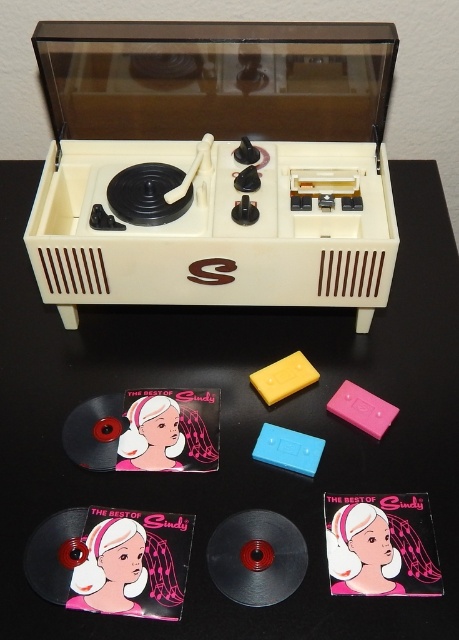
Question: Is beige plastic record player at center bigger than matte pink vinyl record at lower left?

Choices:
 (A) no
 (B) yes

Answer: (B)

Question: Is matte pink vinyl record at lower center to the left of black plastic record at center from the viewer's perspective?

Choices:
 (A) yes
 (B) no

Answer: (B)

Question: Which is farther from the matte pink vinyl record at lower left?

Choices:
 (A) black plastic record at center
 (B) matte plastic record at lower left

Answer: (B)

Question: Is matte pink vinyl record at lower left positioned before black plastic record at center?

Choices:
 (A) yes
 (B) no

Answer: (A)

Question: Which of the following is the closest to the observer?

Choices:
 (A) matte pink vinyl record at lower left
 (B) beige plastic record player at center

Answer: (A)

Question: Among these objects, which one is farthest from the camera?

Choices:
 (A) matte plastic record at lower left
 (B) matte pink vinyl record at lower left

Answer: (A)